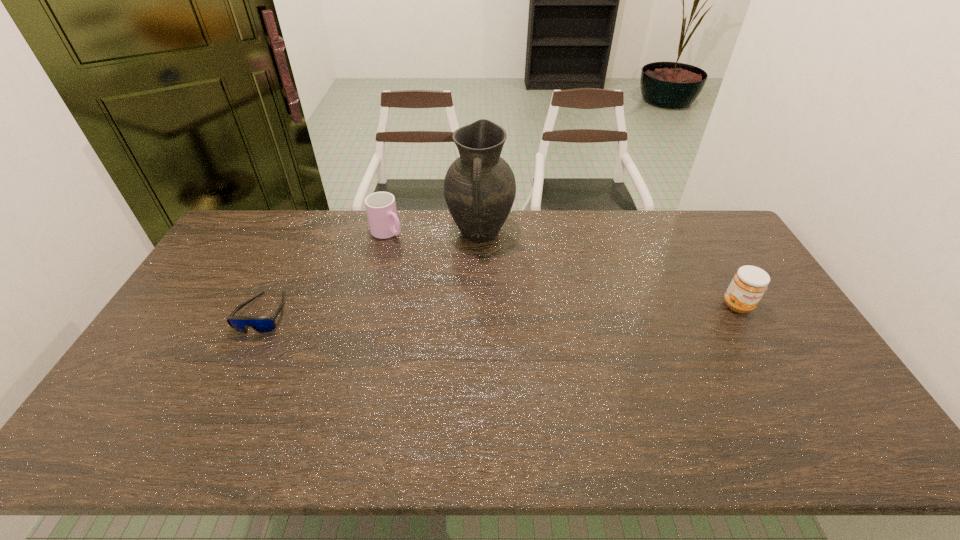
You are a GUI agent. You are given a task and a screenshot of the screen. Output one action in this format:
    pyautogui.click(x=<x>, y=<y>)
    Task: Click on the vacant space on the desktop that is between the leftmost object and the jam and is positioned on the side of the pitcher with the handle
    The height and width of the screenshot is (540, 960).
    Given the screenshot: What is the action you would take?
    pyautogui.click(x=471, y=310)

Image resolution: width=960 pixels, height=540 pixels. Find the location of `vacant space on the desktop that is between the sunglasses and the jam and is positioned with the handle on the side of the third object from right to left`. vacant space on the desktop that is between the sunglasses and the jam and is positioned with the handle on the side of the third object from right to left is located at coordinates (492, 309).